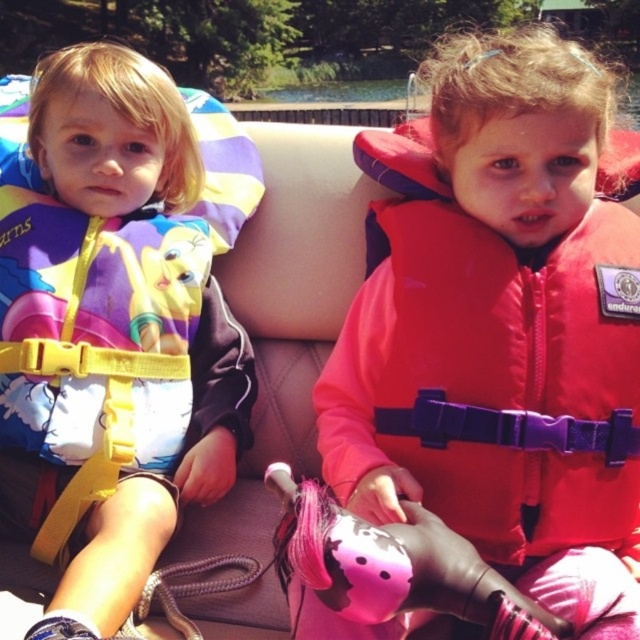
You are a photographer trying to capture a clear shot of the two children in the boat. You notice the point at coordinates (109, 333) corresponds to the matte yellow life vest at left. Where should you focus your camera to ensure the matte yellow life vest at left is in sharp focus?

You should focus your camera on the point at coordinates (109, 333) to ensure the matte yellow life vest at left is in sharp focus.

You are navigating a small boat on the lake and need to reach a destination marked by point (454, 168). There is an obstacle at point (102, 442). Which point should you avoid to safely reach your destination?

You should avoid point (102, 442) because it is behind point (454, 168), meaning it lies between your current position and the destination, creating an obstacle in your path.